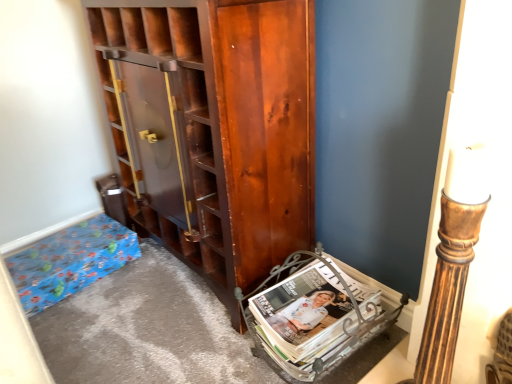
Image resolution: width=512 pixels, height=384 pixels. I want to click on free space above blue paper bag at lower left (from a real-world perspective), so click(49, 248).